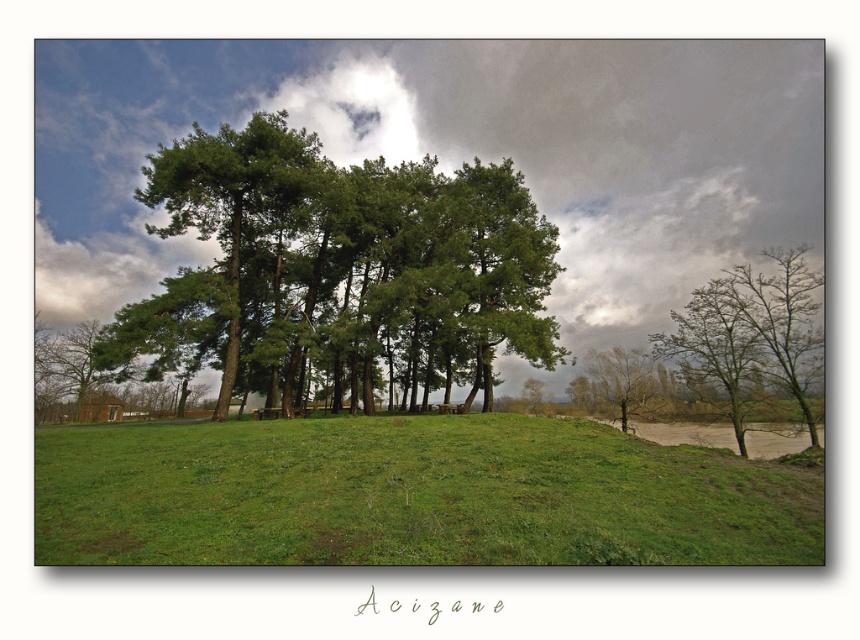
Question: Does green grassy field at center come in front of green matte tree at center?

Choices:
 (A) yes
 (B) no

Answer: (A)

Question: Can you confirm if green matte tree at center is wider than bare branches tree at right?

Choices:
 (A) yes
 (B) no

Answer: (A)

Question: Estimate the real-world distances between objects in this image. Which object is closer to the green grassy field at center?

Choices:
 (A) bare branches tree at lower right
 (B) green matte tree at center

Answer: (B)

Question: Which point appears closest to the camera in this image?

Choices:
 (A) (650, 397)
 (B) (744, 476)
 (C) (286, 308)

Answer: (B)

Question: Which point is closer to the camera?

Choices:
 (A) green matte tree at center
 (B) green grassy field at center

Answer: (B)

Question: Considering the relative positions of green grassy field at center and bare branches tree at lower right in the image provided, where is green grassy field at center located with respect to bare branches tree at lower right?

Choices:
 (A) above
 (B) below

Answer: (A)